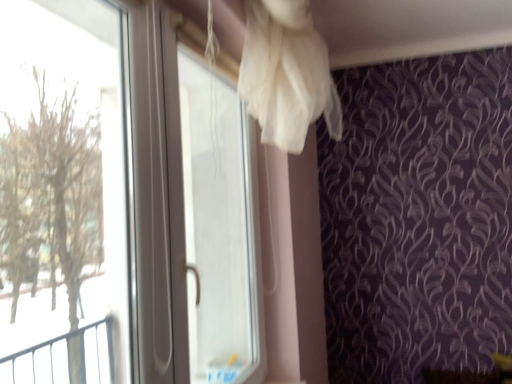
Describe the element at coordinates (219, 229) in the screenshot. Image resolution: width=512 pixels, height=384 pixels. I see `transparent plastic screen door at upper center` at that location.

Measure the distance between point [211,83] and camera.

The distance of point [211,83] from camera is 1.90 meters.

This screenshot has width=512, height=384. Find the location of `transparent plastic screen door at upper center`. transparent plastic screen door at upper center is located at coordinates (219, 229).

The height and width of the screenshot is (384, 512). Describe the element at coordinates (122, 204) in the screenshot. I see `transparent plastic window at left` at that location.

What are the coordinates of `transparent plastic window at left` in the screenshot? It's located at (122, 204).

Locate an element on the screen. This screenshot has height=384, width=512. transparent plastic screen door at upper center is located at coordinates (219, 229).

Considering the positions of objects transparent plastic screen door at upper center and transparent plastic window at left in the image provided, who is more to the left, transparent plastic screen door at upper center or transparent plastic window at left?

transparent plastic window at left.

Considering the positions of objects transparent plastic screen door at upper center and transparent plastic window at left in the image provided, who is behind, transparent plastic screen door at upper center or transparent plastic window at left?

Positioned behind is transparent plastic screen door at upper center.

Which point is more distant from viewer, (179, 73) or (193, 140)?

The point (193, 140) is more distant.

From the image's perspective, is transparent plastic screen door at upper center over transparent plastic window at left?

No.

From a real-world perspective, which object stands above the other?

transparent plastic window at left.

Which of these two, transparent plastic screen door at upper center or transparent plastic window at left, is thinner?

With smaller width is transparent plastic window at left.

In terms of height, does transparent plastic screen door at upper center look taller or shorter compared to transparent plastic window at left?

In the image, transparent plastic screen door at upper center appears to be taller than transparent plastic window at left.

Does transparent plastic screen door at upper center have a smaller size compared to transparent plastic window at left?

No, transparent plastic screen door at upper center is not smaller than transparent plastic window at left.

Is transparent plastic screen door at upper center completely or partially outside of transparent plastic window at left?

Absolutely, transparent plastic screen door at upper center is external to transparent plastic window at left.

Would you consider transparent plastic screen door at upper center to be distant from transparent plastic window at left?

transparent plastic screen door at upper center is positioned a significant distance from transparent plastic window at left.

Is transparent plastic screen door at upper center facing towards transparent plastic window at left?

No, transparent plastic screen door at upper center is not aimed at transparent plastic window at left.

Measure the distance between transparent plastic screen door at upper center and transparent plastic window at left.

transparent plastic screen door at upper center and transparent plastic window at left are 1.40 meters apart from each other.

Find the location of a particular element. window that is on the left side of transparent plastic screen door at upper center is located at coordinates (122, 204).

Is transparent plastic window at left to the left of transparent plastic screen door at upper center from the viewer's perspective?

Yes.

Does transparent plastic window at left lie behind transparent plastic screen door at upper center?

No, transparent plastic window at left is in front of transparent plastic screen door at upper center.

Which is in front, point (252, 323) or point (221, 245)?

Positioned in front is point (252, 323).

Based on the photo, from the image's perspective, does transparent plastic window at left appear lower than transparent plastic screen door at upper center?

No, from the image's perspective, transparent plastic window at left is not beneath transparent plastic screen door at upper center.

From a real-world perspective, relative to transparent plastic screen door at upper center, is transparent plastic window at left vertically above or below?

transparent plastic window at left is above transparent plastic screen door at upper center.

Between transparent plastic window at left and transparent plastic screen door at upper center, which one has larger width?

With larger width is transparent plastic screen door at upper center.

Who is shorter, transparent plastic window at left or transparent plastic screen door at upper center?

With less height is transparent plastic window at left.

Who is bigger, transparent plastic window at left or transparent plastic screen door at upper center?

transparent plastic screen door at upper center.

Which is correct: transparent plastic window at left is inside transparent plastic screen door at upper center, or outside of it?

transparent plastic window at left is not enclosed by transparent plastic screen door at upper center.

Is transparent plastic window at left next to transparent plastic screen door at upper center?

No, transparent plastic window at left is not beside transparent plastic screen door at upper center.

Is transparent plastic window at left facing towards transparent plastic screen door at upper center?

No, transparent plastic window at left is not facing towards transparent plastic screen door at upper center.

Can you tell me how much transparent plastic window at left and transparent plastic screen door at upper center differ in facing direction?

There is a 1.18-degree angle between the facing directions of transparent plastic window at left and transparent plastic screen door at upper center.

How much distance is there between transparent plastic window at left and transparent plastic screen door at upper center?

They are 1.40 meters apart.

You are a GUI agent. You are given a task and a screenshot of the screen. Output one action in this format:
    pyautogui.click(x=<x>, y=<y>)
    Task: Click on the window above the transparent plastic screen door at upper center (from a real-world perspective)
    The height and width of the screenshot is (384, 512).
    Given the screenshot: What is the action you would take?
    pyautogui.click(x=122, y=204)

Identify the location of screen door on the right of the transparent plastic window at left. The width and height of the screenshot is (512, 384). (219, 229).

Image resolution: width=512 pixels, height=384 pixels. I want to click on window located above the transparent plastic screen door at upper center (from a real-world perspective), so click(122, 204).